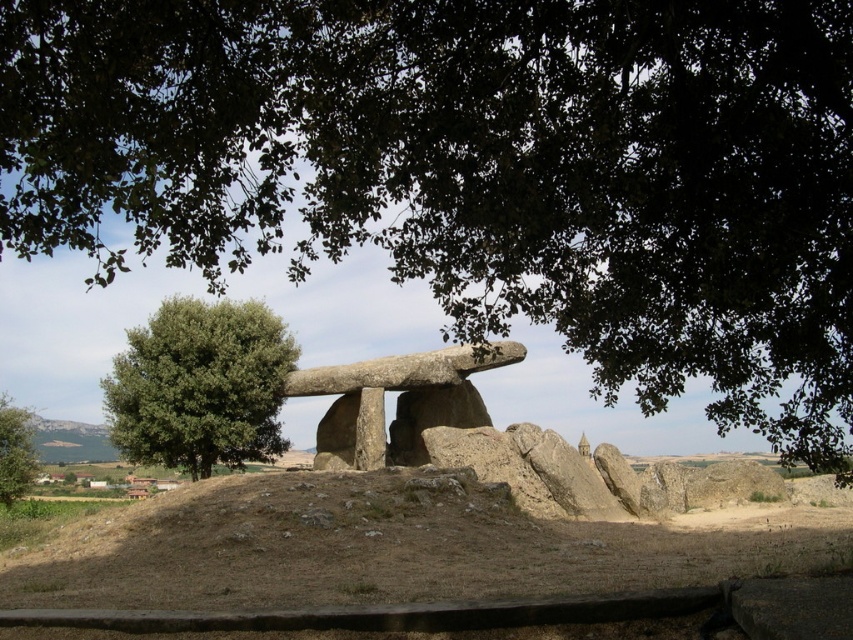
Question: Which of these objects is positioned closest to the green leafy tree at left?

Choices:
 (A) green leafy tree at lower left
 (B) brown soil at center

Answer: (A)

Question: Which point is closer to the camera?

Choices:
 (A) green leafy tree at lower left
 (B) green leafy tree at left

Answer: (B)

Question: Among these objects, which one is farthest from the camera?

Choices:
 (A) green leafy tree at lower left
 (B) brown soil at center
 (C) green leafy tree at left

Answer: (A)

Question: Can you confirm if brown soil at center is wider than green leafy tree at left?

Choices:
 (A) no
 (B) yes

Answer: (B)

Question: Does green leafy tree at left have a lesser width compared to green leafy tree at lower left?

Choices:
 (A) yes
 (B) no

Answer: (B)

Question: Where is brown soil at center located in relation to green leafy tree at lower left in the image?

Choices:
 (A) left
 (B) right

Answer: (B)